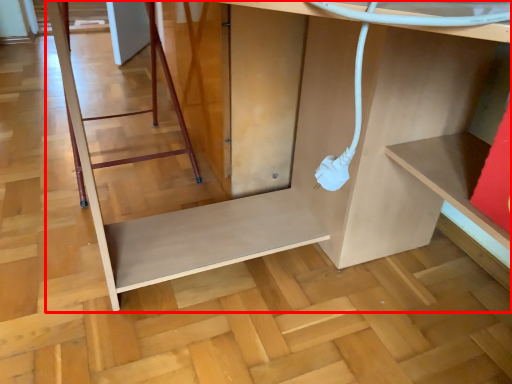
Question: Observing the image, what is the correct spatial positioning of furniture (annotated by the red box) in reference to ladder?

Choices:
 (A) right
 (B) left

Answer: (A)